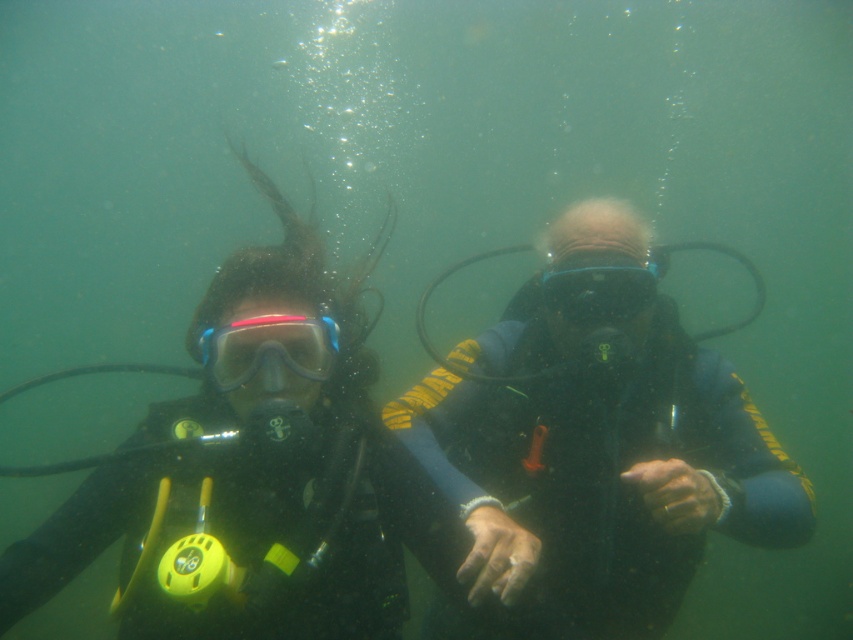
Question: Does blue matte scuba mask at center have a larger size compared to transparent rubber goggles at center?

Choices:
 (A) yes
 (B) no

Answer: (B)

Question: Which point is closer to the camera?

Choices:
 (A) pos(335,342)
 (B) pos(627,422)

Answer: (A)

Question: Can you confirm if blue matte scuba mask at center is positioned to the right of transparent rubber goggles at center?

Choices:
 (A) yes
 (B) no

Answer: (B)

Question: Which point appears closest to the camera in this image?

Choices:
 (A) (669, 365)
 (B) (257, 333)

Answer: (B)

Question: Does black rubber wetsuit at center lie in front of transparent rubber goggles at center?

Choices:
 (A) no
 (B) yes

Answer: (B)

Question: Which of the following is the farthest from the observer?

Choices:
 (A) (598, 266)
 (B) (759, 516)
 (C) (223, 358)

Answer: (A)